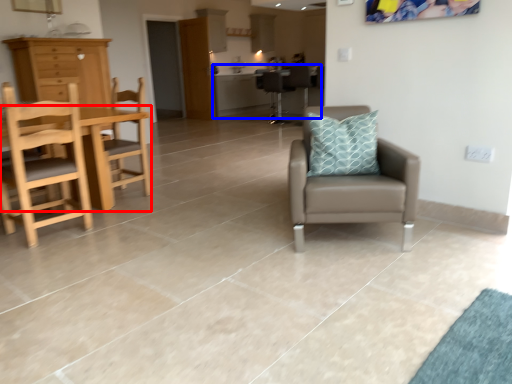
Question: Which object is closer to the camera taking this photo, table (highlighted by a red box) or table (highlighted by a blue box)?

Choices:
 (A) table
 (B) table

Answer: (A)